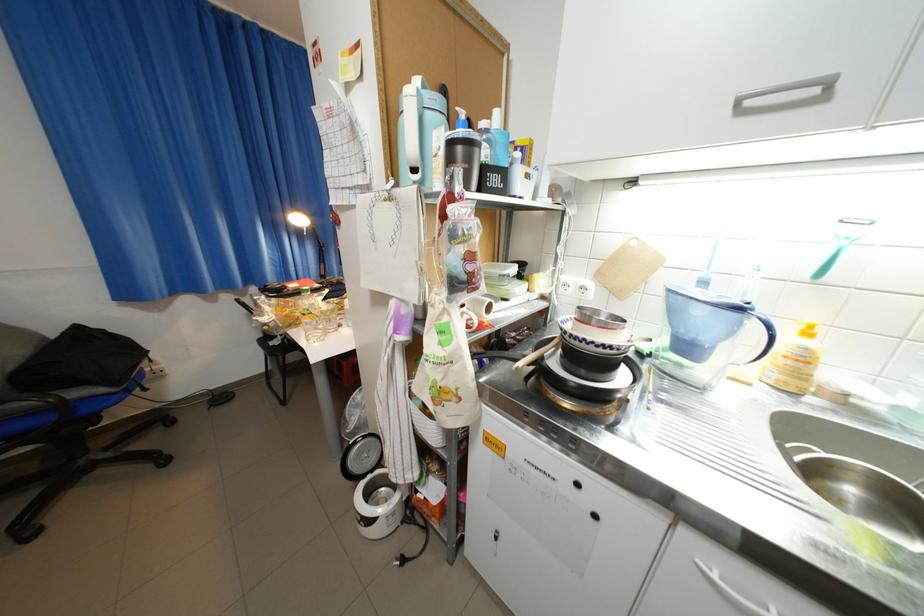
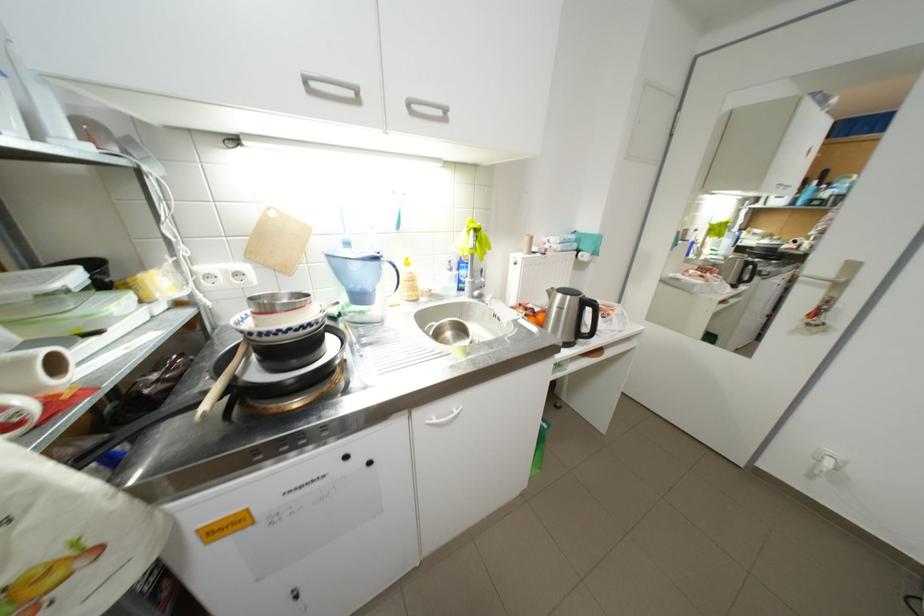
Locate, in the second image, the point that corresponds to (x=750, y=103) in the first image.

(317, 79)